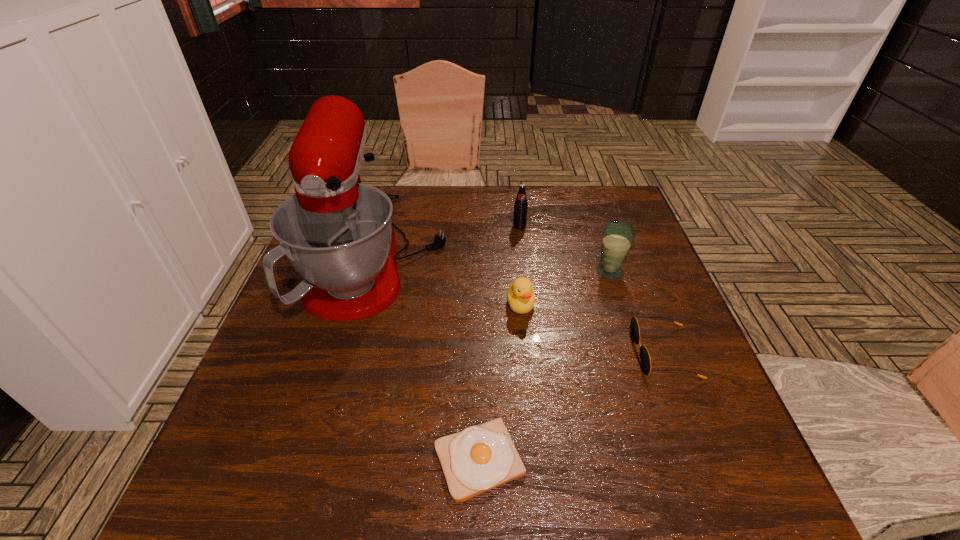
Find the location of `glass located at the right edge`. glass located at the right edge is located at coordinates (618, 236).

Identify the location of sunglasses that is at the right edge. This screenshot has height=540, width=960. (645, 359).

In order to click on object that is positioned at the far left corner in this screenshot , I will do `click(337, 233)`.

In the image, there is a desktop. Where is `free space at the far edge`? The width and height of the screenshot is (960, 540). free space at the far edge is located at coordinates (411, 195).

The width and height of the screenshot is (960, 540). I want to click on free space at the near edge, so click(x=444, y=485).

In the image, there is a desktop. Identify the location of vacant space at the left edge. Image resolution: width=960 pixels, height=540 pixels. (266, 447).

The height and width of the screenshot is (540, 960). I want to click on blank space at the right edge of the desktop, so click(x=609, y=304).

The width and height of the screenshot is (960, 540). I want to click on free space at the near left corner of the desktop, so click(x=289, y=497).

This screenshot has width=960, height=540. Identify the location of free region at the far right corner of the desktop. (610, 193).

Image resolution: width=960 pixels, height=540 pixels. In order to click on free area in between the glass and the pop in this screenshot , I will do `click(564, 249)`.